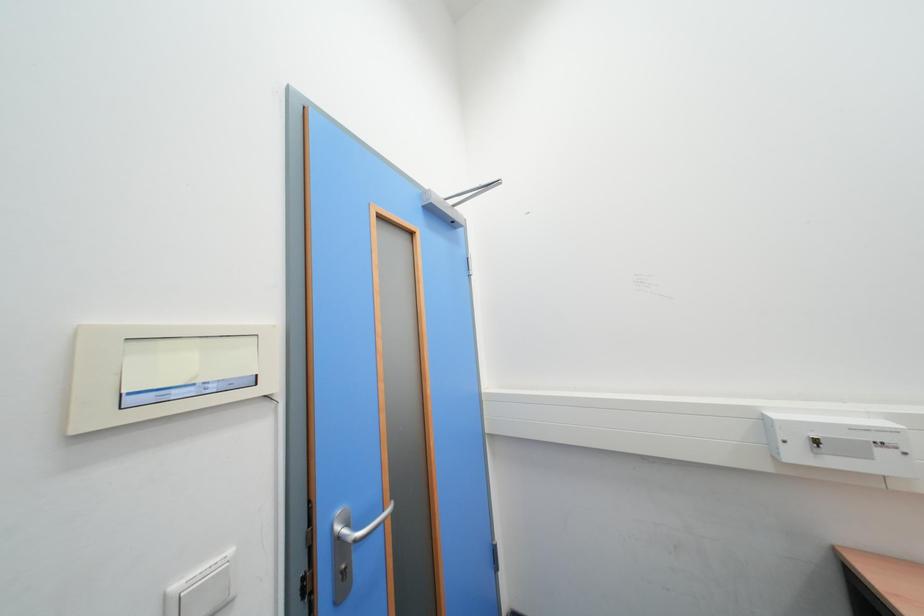
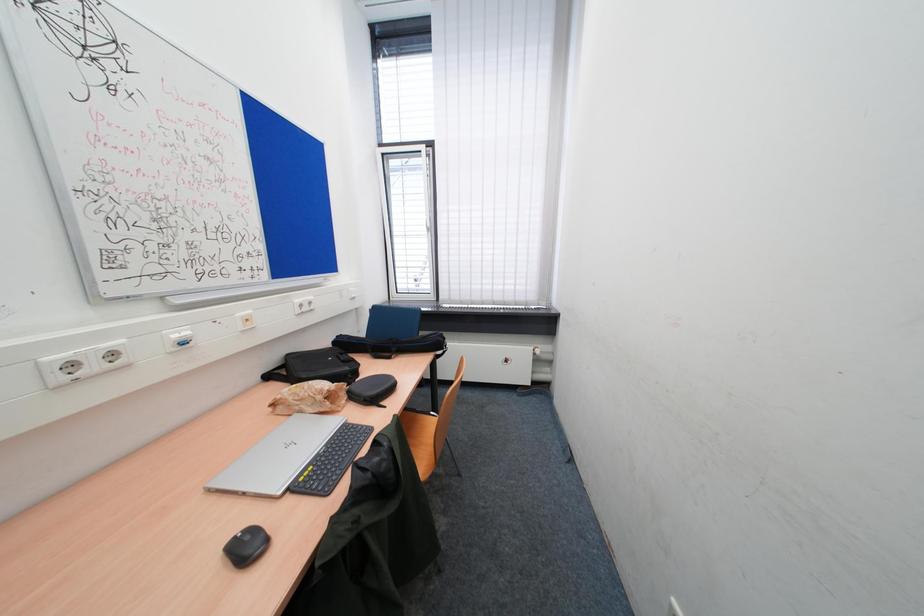
Question: The images are taken continuously from a first-person perspective. In which direction is your viewpoint rotating?

Choices:
 (A) Left
 (B) Right
 (C) Up
 (D) Down

Answer: (B)